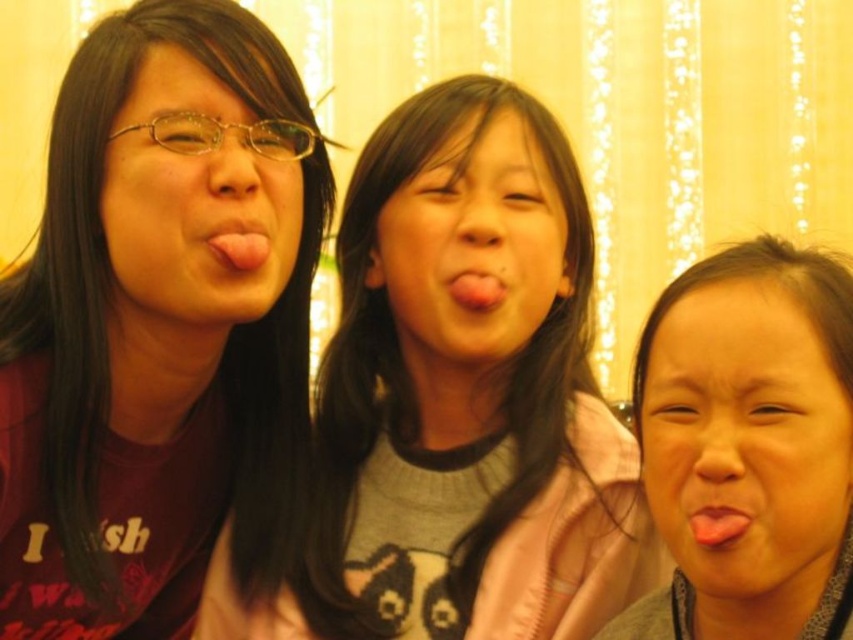
You are a photographer standing 10 meters away from the matte black face at left and smooth skin face at center. Can you take a photo of both faces in the same frame without moving your camera?

The distance between the matte black face at left and smooth skin face at center is 9.40 meters. Since you are 10 meters away from both faces, the total distance between them is less than your distance from them, so they can fit in the same frame without moving the camera.

You are a photographer adjusting the focus on your camera. The camera is set to focus on the center point. Based on the scene, will the pink glossy tongue at center be in focus?

The pink glossy tongue at center is located at point [239,244], which is the center point where the camera is focused. Therefore, the pink glossy tongue at center will be in focus.

Based on the photo, you are a photographer trying to capture a closeup of the pink glossy tongue at center and the pink glossy tongue at lower right. Which one is positioned more to the left side of the frame?

The pink glossy tongue at center is positioned more to the left side of the frame compared to the pink glossy tongue at lower right.